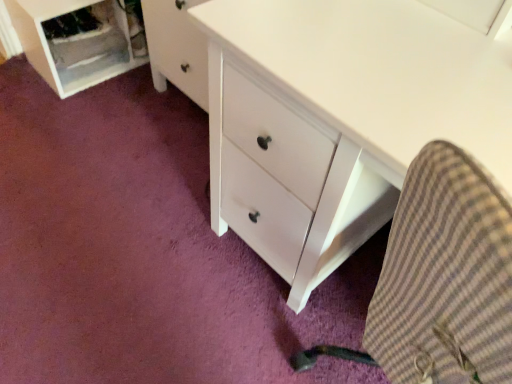
Find the location of a particular element. vacant space to the right of white plastic file cabinet at lower left is located at coordinates (137, 91).